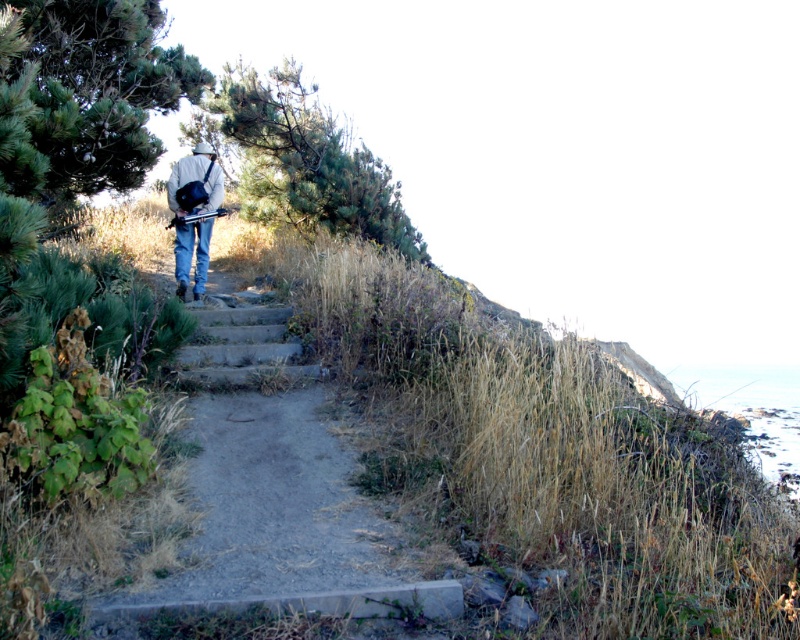
Can you confirm if dull concrete steps at center is positioned to the left of denim jacket at upper center?

No, dull concrete steps at center is not to the left of denim jacket at upper center.

In the scene shown: Does dull concrete steps at center come behind denim jacket at upper center?

No, dull concrete steps at center is in front of denim jacket at upper center.

Locate an element on the screen. dull concrete steps at center is located at coordinates (284, 518).

Locate an element on the screen. This screenshot has height=640, width=800. dull concrete steps at center is located at coordinates (284, 518).